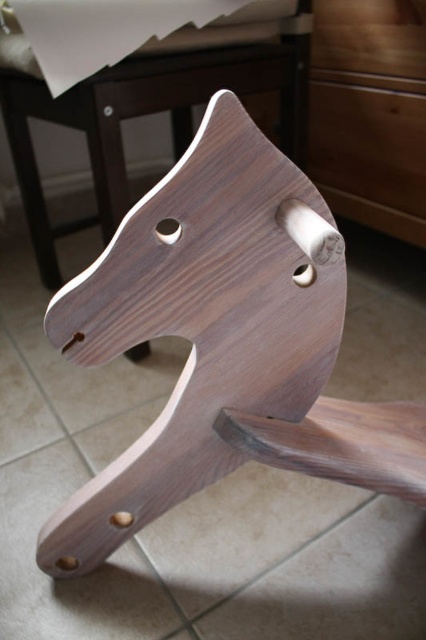
Question: Does dark wood/texture rocking horse at center appear on the left side of wooden drawer at upper right?

Choices:
 (A) yes
 (B) no

Answer: (A)

Question: Which object appears farthest from the camera in this image?

Choices:
 (A) dark wood/texture rocking horse at center
 (B) wooden drawer at upper right

Answer: (B)

Question: Which point is closer to the camera taking this photo?

Choices:
 (A) coord(204,454)
 (B) coord(324,108)

Answer: (A)

Question: Where is dark wood/texture rocking horse at center located in relation to wooden drawer at upper right in the image?

Choices:
 (A) below
 (B) above

Answer: (A)

Question: Can you confirm if dark wood/texture rocking horse at center is bigger than wooden drawer at upper right?

Choices:
 (A) no
 (B) yes

Answer: (B)